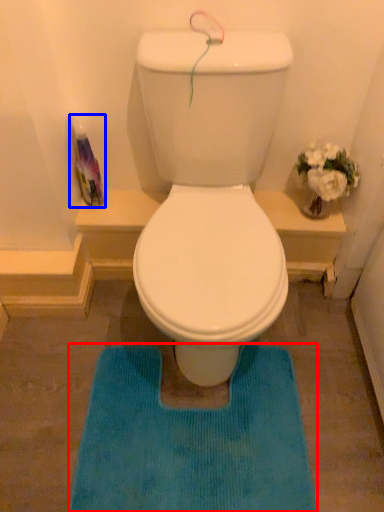
Question: Which object is further to the camera taking this photo, bath mat (highlighted by a red box) or bottle (highlighted by a blue box)?

Choices:
 (A) bath mat
 (B) bottle

Answer: (B)